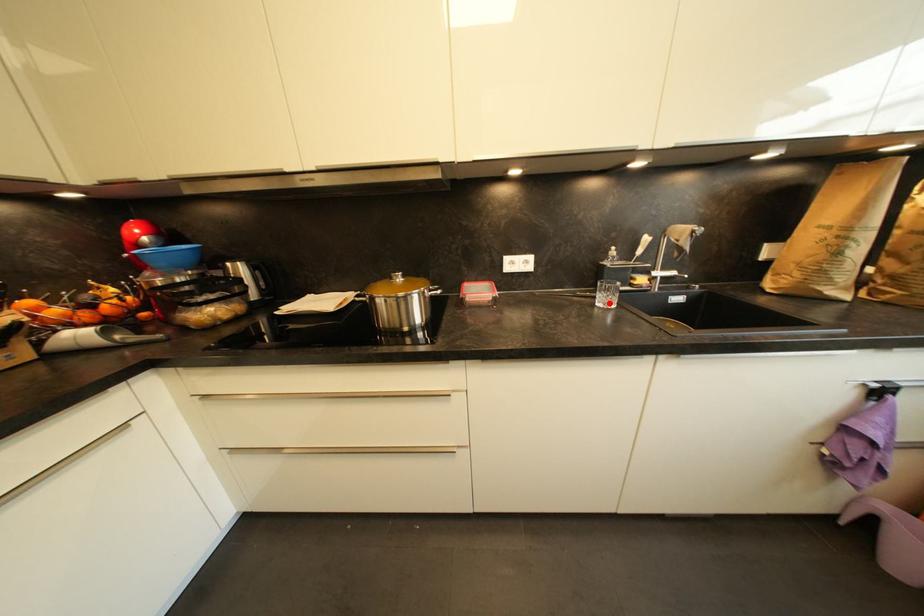
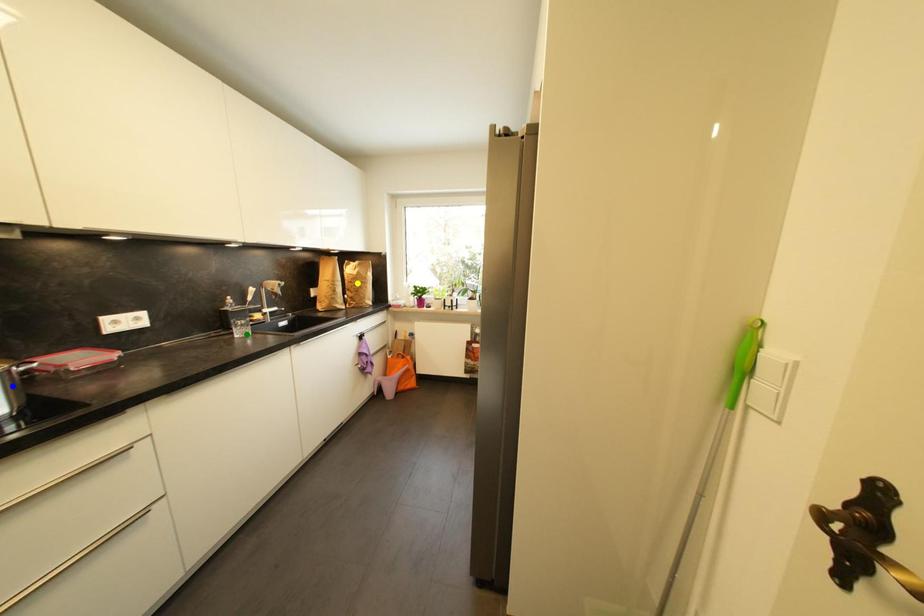
Question: I am providing you with two images of the same scene from different viewpoints. A red point is marked on the first image. You are given multiple points on the second image. In image 2, which mark is for the same physical point as the one in image 1?

Choices:
 (A) green point
 (B) yellow point
 (C) blue point

Answer: (A)